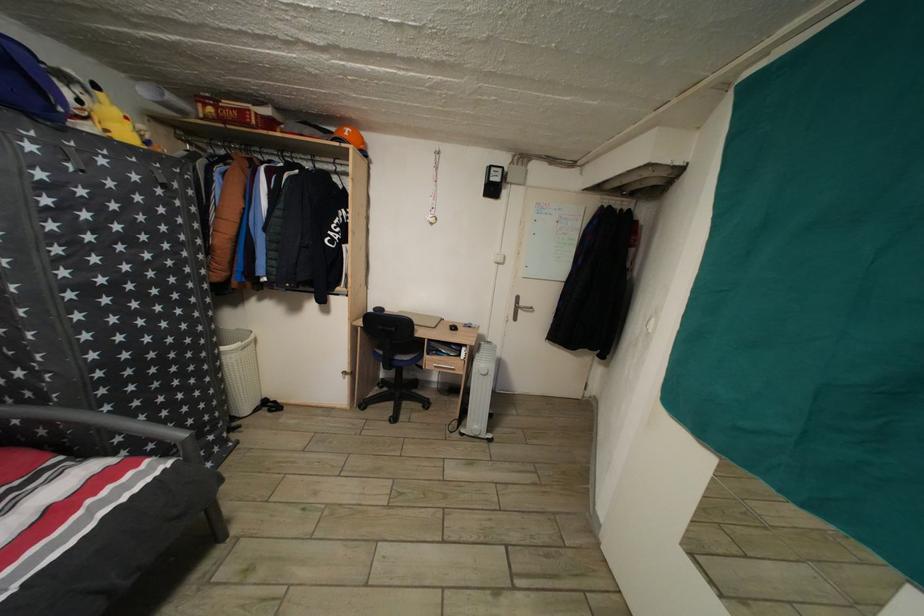
Describe the element at coordinates (521, 305) in the screenshot. I see `a silver door handle` at that location.